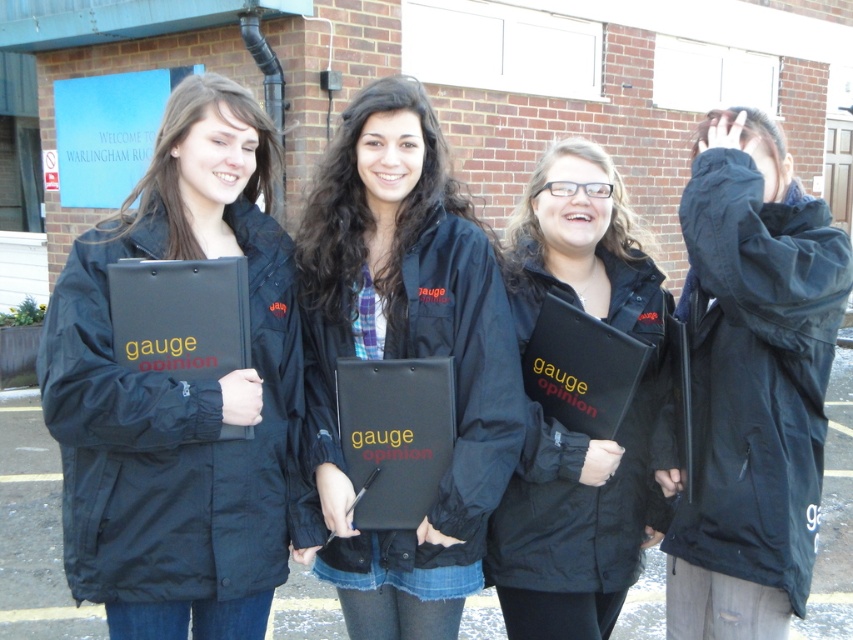
You are a researcher who needs to record data on the matte black clipboard at left and the black matte jacket at right. Which object has a bigger surface area for writing?

The matte black clipboard at left has a larger size compared to the black matte jacket at right, so it has a bigger surface area for writing.

You are a researcher who needs to hand out surveys to participants. You have a matte black clipboard at left and a matte black folder at center. Which object should you reach for first if you want to access the survey materials quickly?

The matte black clipboard at left is to the left of the matte black folder at center, so you should reach for the matte black clipboard at left first as it is closer to your left side.